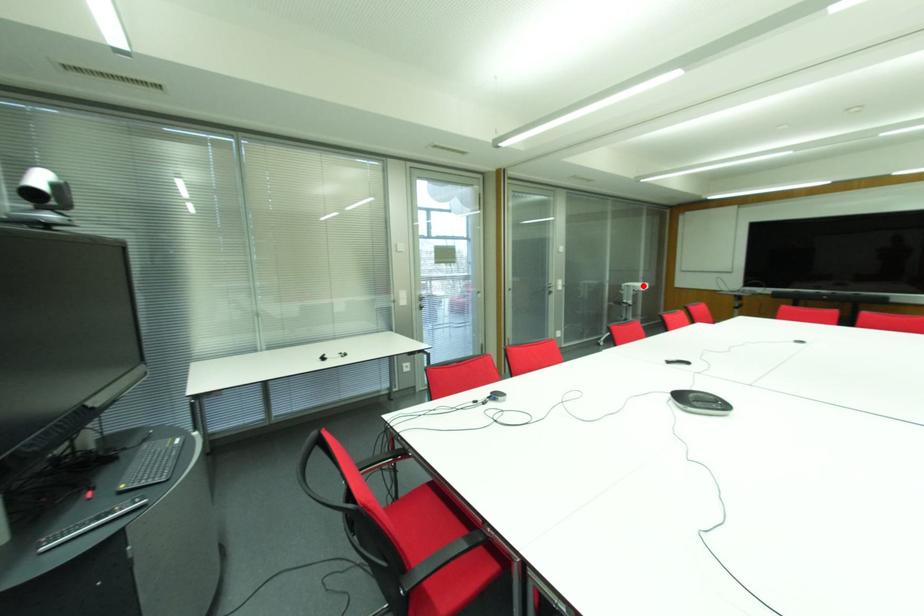
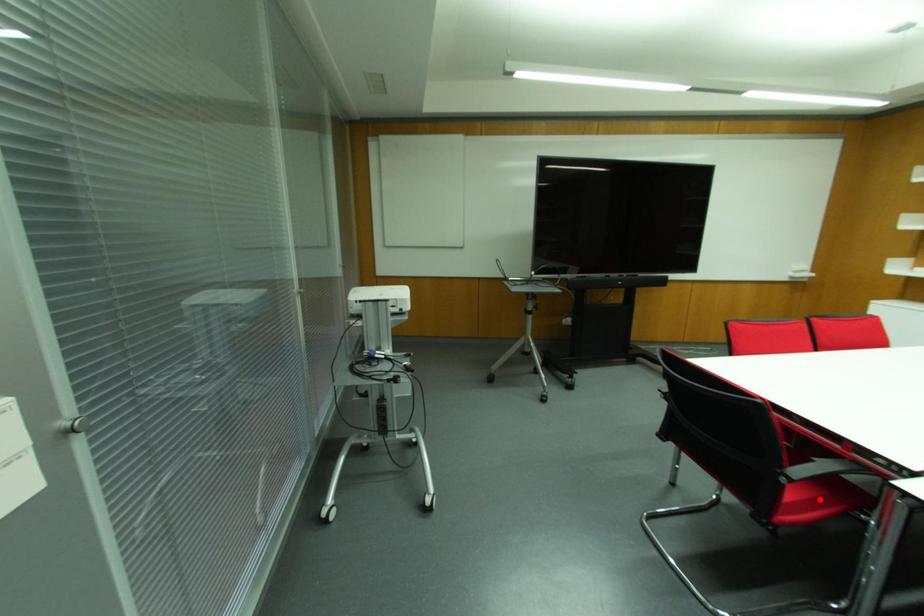
I am providing you with two images of the same scene from different viewpoints. A red point is marked on the first image and another point is marked on the second image. Are the points marked in image1 and image2 representing the same 3D position?

No